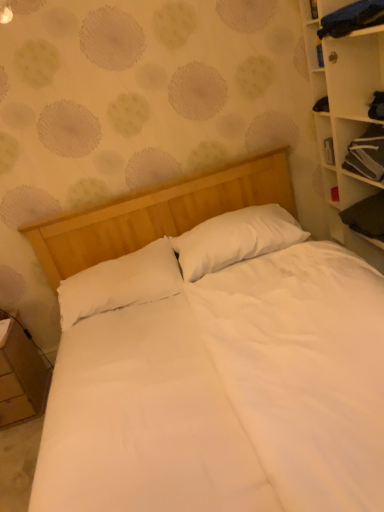
Where is `white soft pillow at center, marked as the first pillow in a right-to-left arrangement`? The image size is (384, 512). white soft pillow at center, marked as the first pillow in a right-to-left arrangement is located at coordinates (235, 239).

Measure the distance between white soft pillow at center, arranged as the 2th pillow when viewed from the right, and camera.

The depth of white soft pillow at center, arranged as the 2th pillow when viewed from the right, is 2.03 meters.

Identify the location of white wood bookcase at right. (345, 115).

From the image's perspective, is black fabric cabinet at upper right positioned above or below wooden nightstand at lower left?

black fabric cabinet at upper right is above wooden nightstand at lower left.

From a real-world perspective, which object stands above the other?

black fabric cabinet at upper right.

Is black fabric cabinet at upper right inside the boundaries of wooden nightstand at lower left, or outside?

black fabric cabinet at upper right cannot be found inside wooden nightstand at lower left.

Between black fabric cabinet at upper right and wooden nightstand at lower left, which one has smaller size?

black fabric cabinet at upper right is smaller.

Is black fabric cabinet at upper right inside or outside of white soft pillow at center, placed as the first pillow when sorted from left to right?

black fabric cabinet at upper right exists outside the volume of white soft pillow at center, placed as the first pillow when sorted from left to right.

Consider the image. Can you confirm if black fabric cabinet at upper right is smaller than white soft pillow at center, placed as the first pillow when sorted from left to right?

Yes.

Could you measure the distance between black fabric cabinet at upper right and white soft pillow at center, placed as the first pillow when sorted from left to right?

black fabric cabinet at upper right is 1.21 meters from white soft pillow at center, placed as the first pillow when sorted from left to right.

Is point (88, 271) closer to camera compared to point (369, 154)?

No, it is behind (369, 154).

Considering the relative sizes of white soft pillow at center, placed as the first pillow when sorted from left to right, and black fabric cabinet at upper right in the image provided, is white soft pillow at center, placed as the first pillow when sorted from left to right, taller than black fabric cabinet at upper right?

Yes.

In the scene shown: Is white soft pillow at center, arranged as the 2th pillow when viewed from the right, facing away from black fabric cabinet at upper right?

No.

From the image's perspective, is white soft pillow at center, arranged as the 2th pillow when viewed from the left, over white wood bookcase at right?

Actually, white soft pillow at center, arranged as the 2th pillow when viewed from the left, appears below white wood bookcase at right in the image.

Based on the photo, from a real-world perspective, between white soft pillow at center, marked as the first pillow in a right-to-left arrangement, and white wood bookcase at right, who is vertically higher?

white wood bookcase at right.

Does point (224, 217) appear closer or farther from the camera than point (383, 253)?

Point (224, 217).

Identify the location of bookcase lying on the right of white soft pillow at center, marked as the first pillow in a right-to-left arrangement. (x=345, y=115).

Based on their positions, is wooden nightstand at lower left located to the left or right of black fabric cabinet at upper right?

Based on their positions, wooden nightstand at lower left is located to the left of black fabric cabinet at upper right.

Is wooden nightstand at lower left positioned with its back to black fabric cabinet at upper right?

No, wooden nightstand at lower left is not facing the opposite direction of black fabric cabinet at upper right.

From the image's perspective, which is above, wooden nightstand at lower left or black fabric cabinet at upper right?

black fabric cabinet at upper right appears higher in the image.

From a real-world perspective, is wooden nightstand at lower left positioned above or below black fabric cabinet at upper right?

wooden nightstand at lower left is below black fabric cabinet at upper right.

At what (x,y) coordinates should I click in order to perform the action: click on the 1st pillow to the left of the black fabric cabinet at upper right, starting your count from the anchor. Please return your answer as a coordinate pair (x, y). Looking at the image, I should click on (235, 239).

Between black fabric cabinet at upper right and white soft pillow at center, marked as the first pillow in a right-to-left arrangement, which one is positioned behind?

Positioned behind is white soft pillow at center, marked as the first pillow in a right-to-left arrangement.

Looking at this image, which of these two, black fabric cabinet at upper right or white soft pillow at center, arranged as the 2th pillow when viewed from the left, stands taller?

Standing taller between the two is white soft pillow at center, arranged as the 2th pillow when viewed from the left.

Is point (357, 150) in front of point (285, 232)?

Yes, it is.

Is white soft pillow at center, arranged as the 2th pillow when viewed from the left, a part of white soft pillow at center, arranged as the 2th pillow when viewed from the right?

A: Actually, white soft pillow at center, arranged as the 2th pillow when viewed from the left, is outside white soft pillow at center, arranged as the 2th pillow when viewed from the right.

Looking at this image, which object is positioned more to the left, white soft pillow at center, placed as the first pillow when sorted from left to right, or white soft pillow at center, marked as the first pillow in a right-to-left arrangement?

From the viewer's perspective, white soft pillow at center, placed as the first pillow when sorted from left to right, appears more on the left side.

Is white soft pillow at center, arranged as the 2th pillow when viewed from the right, taller or shorter than white soft pillow at center, arranged as the 2th pillow when viewed from the left?

white soft pillow at center, arranged as the 2th pillow when viewed from the right, is shorter than white soft pillow at center, arranged as the 2th pillow when viewed from the left.

Locate an element on the screen. cabinet that appears above the wooden nightstand at lower left (from a real-world perspective) is located at coordinates (367, 154).

Find the location of a particular element. the 1st pillow behind the black fabric cabinet at upper right, starting your count from the anchor is located at coordinates click(x=120, y=283).

When comparing their distances from wooden nightstand at lower left, does black fabric cabinet at upper right or white soft pillow at center, marked as the first pillow in a right-to-left arrangement, seem closer?

white soft pillow at center, marked as the first pillow in a right-to-left arrangement, is positioned closer to the anchor wooden nightstand at lower left.

Based on their spatial positions, is black fabric cabinet at upper right or white soft pillow at center, placed as the first pillow when sorted from left to right, closer to white wood bookcase at right?

black fabric cabinet at upper right lies closer to white wood bookcase at right than the other object.

When comparing their distances from white soft pillow at center, placed as the first pillow when sorted from left to right, does white wood bookcase at right or wooden nightstand at lower left seem closer?

Based on the image, wooden nightstand at lower left appears to be nearer to white soft pillow at center, placed as the first pillow when sorted from left to right.

When comparing their distances from white soft pillow at center, placed as the first pillow when sorted from left to right, does wooden nightstand at lower left or white wood bookcase at right seem closer?

The object closer to white soft pillow at center, placed as the first pillow when sorted from left to right, is wooden nightstand at lower left.

Based on their spatial positions, is white soft pillow at center, placed as the first pillow when sorted from left to right, or white soft pillow at center, arranged as the 2th pillow when viewed from the left, further from white wood bookcase at right?

Among the two, white soft pillow at center, placed as the first pillow when sorted from left to right, is located further to white wood bookcase at right.

Which object lies nearer to the anchor point white soft pillow at center, arranged as the 2th pillow when viewed from the left, wooden nightstand at lower left or white soft pillow at center, placed as the first pillow when sorted from left to right?

white soft pillow at center, placed as the first pillow when sorted from left to right, is closer to white soft pillow at center, arranged as the 2th pillow when viewed from the left.

Based on their spatial positions, is wooden nightstand at lower left or white soft pillow at center, marked as the first pillow in a right-to-left arrangement, further from white wood bookcase at right?

wooden nightstand at lower left is further to white wood bookcase at right.

Looking at the image, which one is located closer to white soft pillow at center, arranged as the 2th pillow when viewed from the right, black fabric cabinet at upper right or wooden nightstand at lower left?

Among the two, wooden nightstand at lower left is located nearer to white soft pillow at center, arranged as the 2th pillow when viewed from the right.

Locate an element on the screen. This screenshot has height=512, width=384. cabinet between wooden nightstand at lower left and white wood bookcase at right from left to right is located at coordinates (367, 154).

Locate an element on the screen. pillow located between wooden nightstand at lower left and white soft pillow at center, marked as the first pillow in a right-to-left arrangement, in the left-right direction is located at coordinates (120, 283).

Locate an element on the screen. This screenshot has height=512, width=384. pillow located between white soft pillow at center, placed as the first pillow when sorted from left to right, and white wood bookcase at right in the left-right direction is located at coordinates (235, 239).

Identify the location of pillow between white soft pillow at center, arranged as the 2th pillow when viewed from the right, and black fabric cabinet at upper right. This screenshot has height=512, width=384. (235, 239).